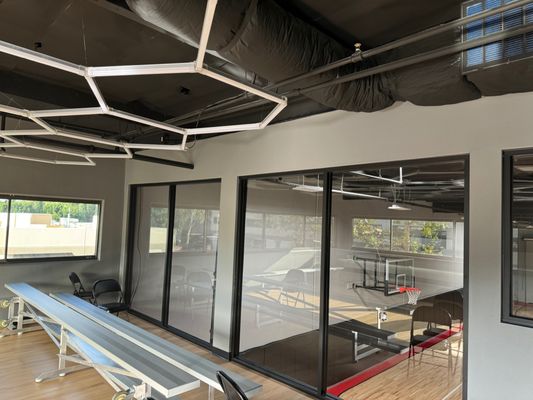
Locate an element on the screen. black cord is located at coordinates pos(138,234).